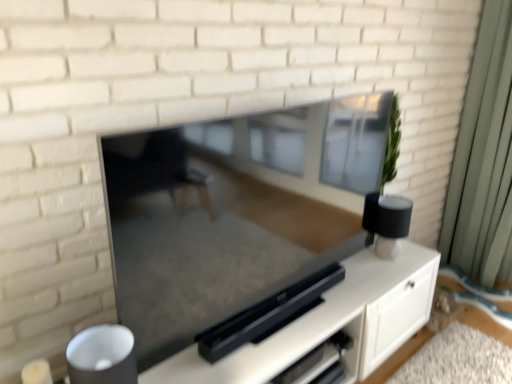
Question: Considering the positions of point (364, 258) and point (480, 213), is point (364, 258) closer or farther from the camera than point (480, 213)?

Choices:
 (A) closer
 (B) farther

Answer: (A)

Question: In terms of height, does satin black entertainment center at center look taller or shorter compared to green fabric curtain at right?

Choices:
 (A) tall
 (B) short

Answer: (B)

Question: Which object is the closest to the matte black tv at center?

Choices:
 (A) green fabric curtain at right
 (B) satin black entertainment center at center

Answer: (B)

Question: Which object is positioned farthest from the satin black entertainment center at center?

Choices:
 (A) matte black tv at center
 (B) green fabric curtain at right

Answer: (B)